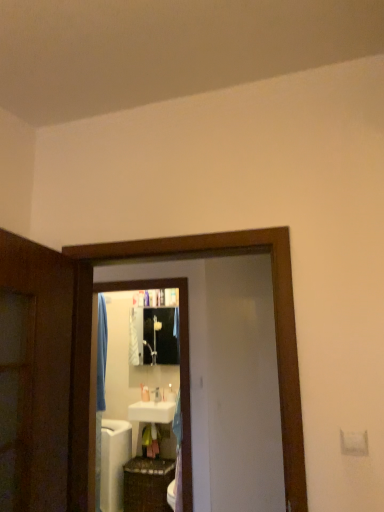
Question: Does white glossy screen door at center, which is counted as the first screen door, starting from the front, have a smaller size compared to white glossy sink at center, which appears as the 1th toiletry when viewed from the front?

Choices:
 (A) no
 (B) yes

Answer: (A)

Question: Is white glossy screen door at center, positioned as the 2th screen door in back-to-front order, positioned with its back to white glossy sink at center, which appears as the 1th toiletry when viewed from the front?

Choices:
 (A) no
 (B) yes

Answer: (B)

Question: Considering the relative positions of white glossy screen door at center, positioned as the 2th screen door in back-to-front order, and white glossy sink at center, the first toiletry positioned from the right, in the image provided, is white glossy screen door at center, positioned as the 2th screen door in back-to-front order, to the right of white glossy sink at center, the first toiletry positioned from the right, from the viewer's perspective?

Choices:
 (A) yes
 (B) no

Answer: (A)

Question: Is white glossy screen door at center, which is counted as the first screen door, starting from the front, wider than white glossy sink at center, which is counted as the second toiletry, starting from the left?

Choices:
 (A) no
 (B) yes

Answer: (B)

Question: Is the position of white glossy screen door at center, which is counted as the first screen door, starting from the front, less distant than that of white glossy sink at center, the first toiletry positioned from the right?

Choices:
 (A) no
 (B) yes

Answer: (B)

Question: From the image's perspective, is white glossy screen door at center, positioned as the 2th screen door in back-to-front order, under white glossy sink at center, acting as the 2th toiletry starting from the back?

Choices:
 (A) no
 (B) yes

Answer: (A)

Question: Does white matte screen door at center, which appears as the 1th screen door when viewed from the back, have a smaller size compared to woven brown basket at lower center?

Choices:
 (A) no
 (B) yes

Answer: (B)

Question: Does white matte screen door at center, which appears as the 1th screen door when viewed from the back, have a lesser height compared to woven brown basket at lower center?

Choices:
 (A) no
 (B) yes

Answer: (A)

Question: Does white matte screen door at center, which appears as the 1th screen door when viewed from the back, lie in front of woven brown basket at lower center?

Choices:
 (A) no
 (B) yes

Answer: (B)

Question: Is the position of white matte screen door at center, placed as the 2th screen door when sorted from front to back, more distant than that of woven brown basket at lower center?

Choices:
 (A) no
 (B) yes

Answer: (A)

Question: Is white matte screen door at center, placed as the 2th screen door when sorted from front to back, surrounding woven brown basket at lower center?

Choices:
 (A) no
 (B) yes

Answer: (A)

Question: Can you confirm if white matte screen door at center, which appears as the 1th screen door when viewed from the back, is thinner than woven brown basket at lower center?

Choices:
 (A) yes
 (B) no

Answer: (A)

Question: Is white matte screen door at center, which appears as the 1th screen door when viewed from the back, wider than black glossy mirror at center?

Choices:
 (A) yes
 (B) no

Answer: (B)